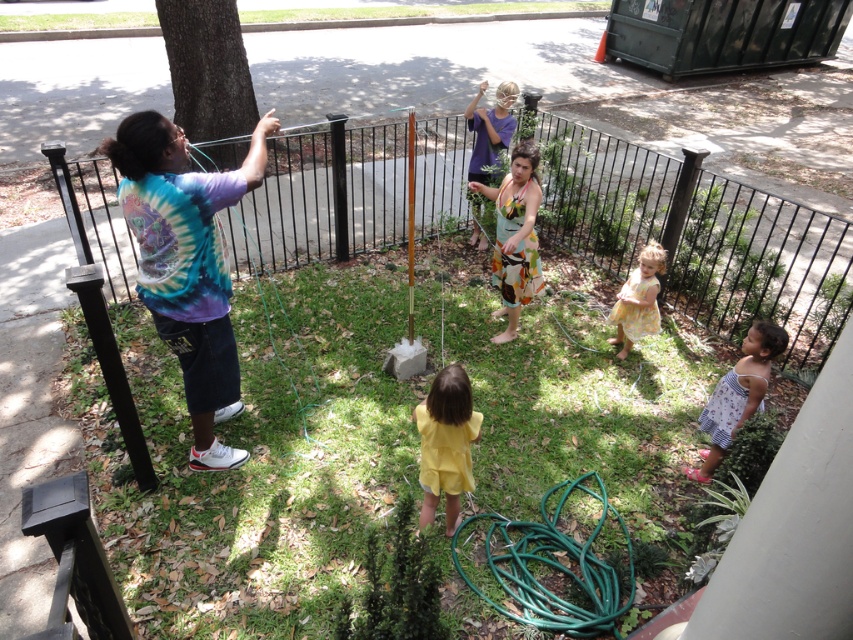
Is yellow fabric dress at center bigger than yellow floral dress at center?

Indeed, yellow fabric dress at center has a larger size compared to yellow floral dress at center.

Who is more forward, (430,436) or (645,248)?

Positioned in front is point (430,436).

The image size is (853, 640). Find the location of `yellow fabric dress at center`. yellow fabric dress at center is located at coordinates (445, 444).

You are a GUI agent. You are given a task and a screenshot of the screen. Output one action in this format:
    pyautogui.click(x=<x>, y=<y>)
    Task: Click on the yellow fabric dress at center
    This screenshot has height=640, width=853.
    Given the screenshot: What is the action you would take?
    pyautogui.click(x=445, y=444)

The height and width of the screenshot is (640, 853). Describe the element at coordinates (260, 458) in the screenshot. I see `green grass at center` at that location.

Is green grass at center above green rubber hose at left?

Actually, green grass at center is below green rubber hose at left.

Does point (254, 317) come farther from viewer compared to point (224, 256)?

Yes, it is.

Find the location of `green grass at center`. green grass at center is located at coordinates (260, 458).

Can you confirm if green rubber garden hose at lower center is shorter than floral cotton dress at center?

Yes.

Between point (502, 522) and point (505, 216), which one is positioned behind?

Positioned behind is point (505, 216).

Identify the location of green rubber garden hose at lower center. (555, 566).